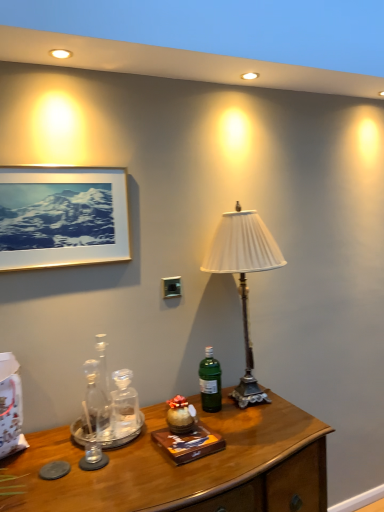
Locate an element on the screen. empty space that is to the right of green glass bottle at center is located at coordinates (263, 416).